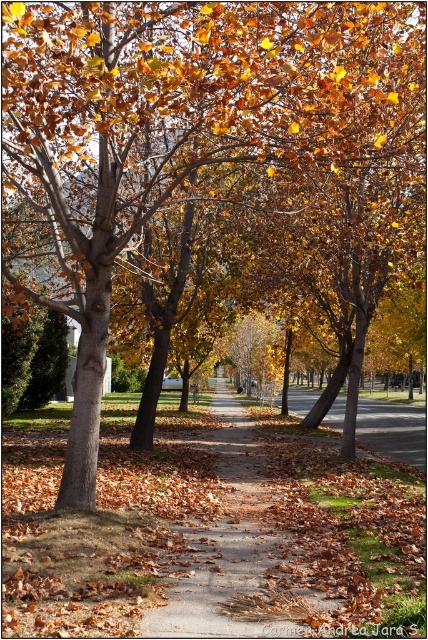
You are a gardener planning to plant flowers along the pathway. You notice the brown dirt path at center and the brown asphalt at center. Which surface is elevated compared to the other?

The brown dirt path at center is elevated compared to the brown asphalt at center as it is positioned above it.

You are a gardener with a wheelbarrow that is 2 meters wide. You need to transport mulch from the dirt path to the asphalt area. Can your wheelbarrow fit through the space between the brown dirt path at center and the brown asphalt at center?

The distance between the brown dirt path at center and the brown asphalt at center is 8.95 meters, which is significantly wider than the 2 meter width of the wheelbarrow. Therefore, the wheelbarrow can easily fit through the space between them.

You are planning to walk along the path in the autumn scene. Which of the two paths, the brown dirt path at center or the brown asphalt at center, will you reach first if you start walking from the entrance at the bottom of the image?

The brown dirt path at center is shorter than the brown asphalt at center, so you will reach the brown dirt path at center first.